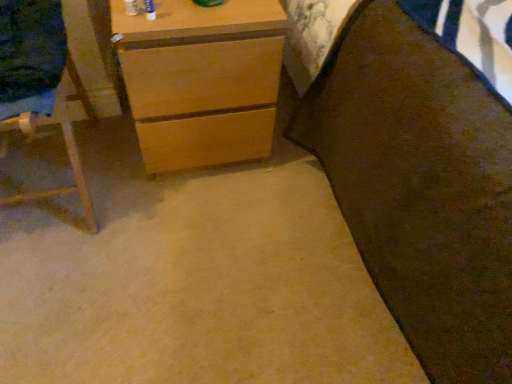
The width and height of the screenshot is (512, 384). Find the location of `vacant space that is in between brown fabric bed at right and light brown wood chest of drawers at upper left`. vacant space that is in between brown fabric bed at right and light brown wood chest of drawers at upper left is located at coordinates (248, 243).